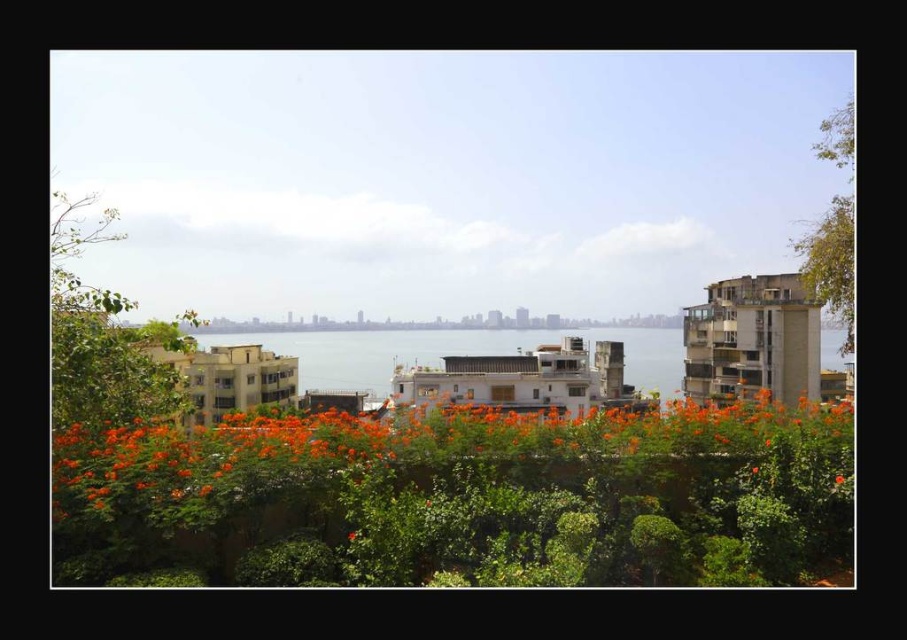
Question: Which object is farther from the camera taking this photo?

Choices:
 (A) green leafy tree at left
 (B) green leafy tree at upper right
 (C) orange matte flowers at center

Answer: (B)

Question: Does green leafy tree at left appear under orange matte flower at center?

Choices:
 (A) no
 (B) yes

Answer: (A)

Question: Which point appears farthest from the camera in this image?

Choices:
 (A) (834, 477)
 (B) (77, 368)
 (C) (630, 483)

Answer: (B)

Question: Among these objects, which one is farthest from the camera?

Choices:
 (A) orange matte flowers at center
 (B) orange matte flower at center
 (C) green leafy tree at upper right
 (D) green leafy tree at left

Answer: (C)

Question: In this image, where is green leafy tree at left located relative to green leafy tree at upper right?

Choices:
 (A) above
 (B) below

Answer: (B)

Question: Considering the relative positions of green leafy tree at upper right and orange matte flower at center in the image provided, where is green leafy tree at upper right located with respect to orange matte flower at center?

Choices:
 (A) left
 (B) right

Answer: (B)